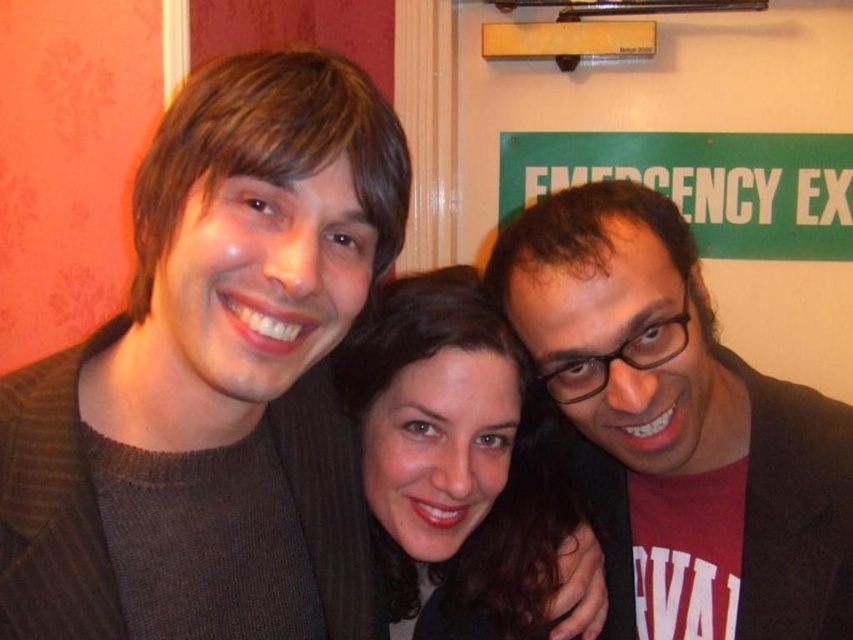
Is black matte glasses at right smaller than matte black hair at center?

No, black matte glasses at right is not smaller than matte black hair at center.

Is black matte glasses at right to the right of matte black hair at center from the viewer's perspective?

Yes, black matte glasses at right is to the right of matte black hair at center.

Does point (750, 368) come closer to viewer compared to point (403, 525)?

No, (750, 368) is behind (403, 525).

Identify the location of black matte glasses at right. 679,428.

Consider the image. Which is more to the left, brown knitted sweater at left or matte black hair at center?

Positioned to the left is brown knitted sweater at left.

Is point (254, 628) closer to camera compared to point (384, 573)?

Yes, point (254, 628) is closer to viewer.

Where is `brown knitted sweater at left`? The height and width of the screenshot is (640, 853). brown knitted sweater at left is located at coordinates (213, 380).

Is brown knitted sweater at left thinner than black matte glasses at right?

Yes, brown knitted sweater at left is thinner than black matte glasses at right.

Who is taller, brown knitted sweater at left or black matte glasses at right?

brown knitted sweater at left

Image resolution: width=853 pixels, height=640 pixels. What are the coordinates of `brown knitted sweater at left` in the screenshot? It's located at (213, 380).